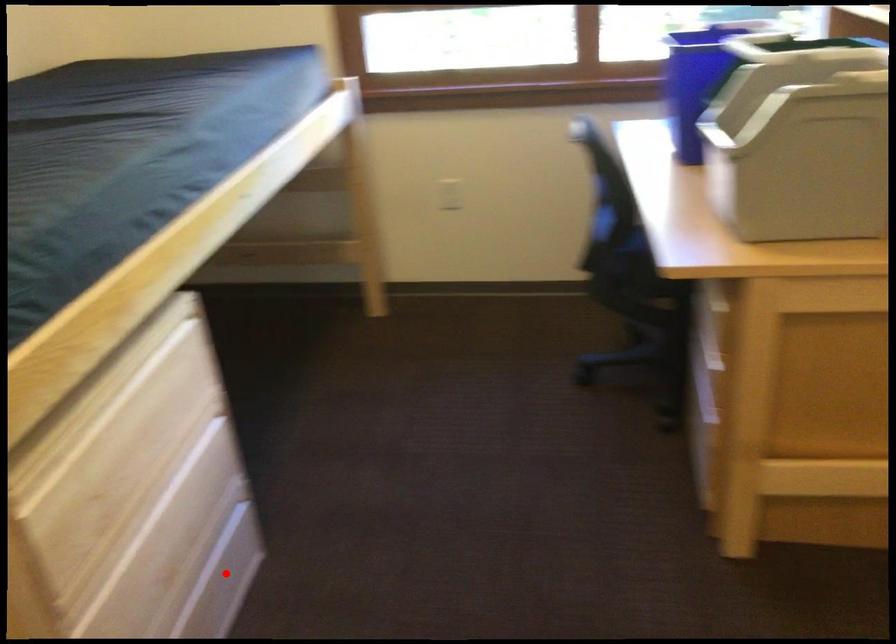
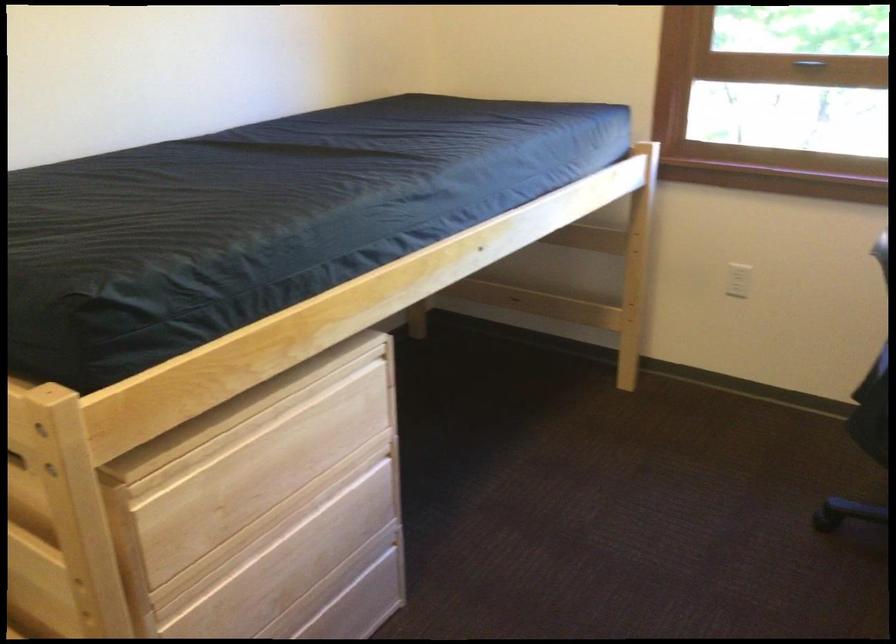
Where in the second image is the point corresponding to the highlighted location from the first image?

(354, 611)